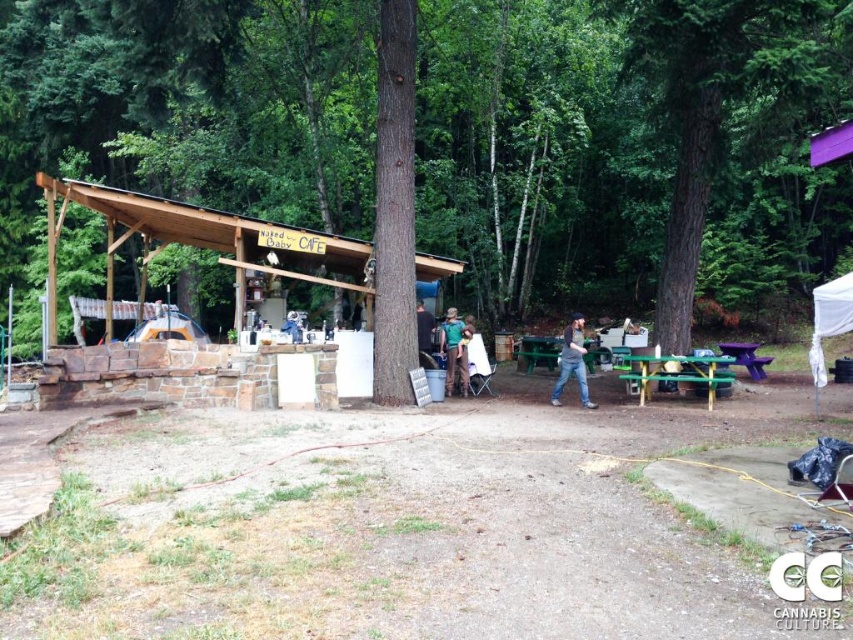
Question: Can you confirm if jeans at center is bigger than green plastic picnic table at lower right?

Choices:
 (A) yes
 (B) no

Answer: (A)

Question: Which is farther from the green fabric backpack at center?

Choices:
 (A) green rough bark tree at center
 (B) orange fabric tent at center
 (C) green painted wood picnic table at center

Answer: (B)

Question: Can you confirm if green fabric shirt at center is positioned below green plastic picnic table at lower right?

Choices:
 (A) yes
 (B) no

Answer: (B)

Question: Where is green fabric shirt at center located in relation to green fabric backpack at center in the image?

Choices:
 (A) left
 (B) right

Answer: (B)

Question: Among these points, which one is nearest to the camera?

Choices:
 (A) (258, 188)
 (B) (833, 10)
 (C) (817, 387)

Answer: (B)

Question: Which point is farther to the camera?

Choices:
 (A) green painted wood picnic table at center
 (B) white fabric tent at right
 (C) green rough bark tree at center

Answer: (C)